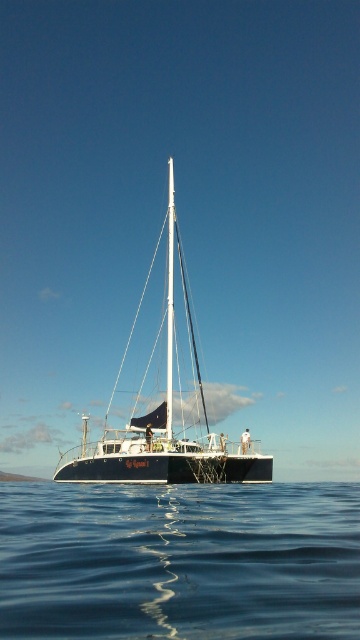
You are a sailor on the catamaran La Gueule. You need to retrieve an item that fell into the water near the boat. Which object, the blue liquid water at lower center or the white glossy mast at center, is closer to you as you stand on the deck?

The blue liquid water at lower center is closer because it is in front of the white glossy mast at center, meaning it is nearer to your position on the deck.

You are a photographer planning to capture the white glossy sailboat at center and the blue liquid water at lower center in a wide shot. Based on the scene, which object will occupy more horizontal space in the photo?

The blue liquid water at lower center will occupy more horizontal space in the photo because its width is larger than the white glossy sailboat at center.

You are a sailor planning to dock your boat next to the white glossy sailboat at center and the white glossy mast at center. Which object is wider so you can choose the right spot for docking?

The white glossy sailboat at center is wider than the white glossy mast at center, so you should dock next to the white glossy sailboat at center.